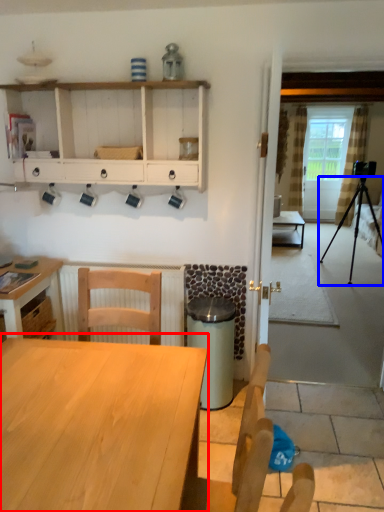
Question: Which object appears farthest to the camera in this image, table (highlighted by a red box) or tripod (highlighted by a blue box)?

Choices:
 (A) table
 (B) tripod

Answer: (B)